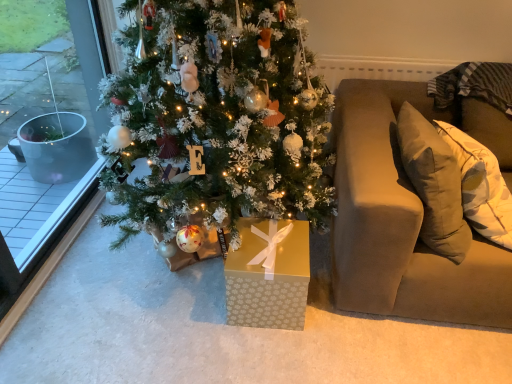
Locate an element on the screen. The height and width of the screenshot is (384, 512). free region on the left part of gold paper gift box at center is located at coordinates (194, 302).